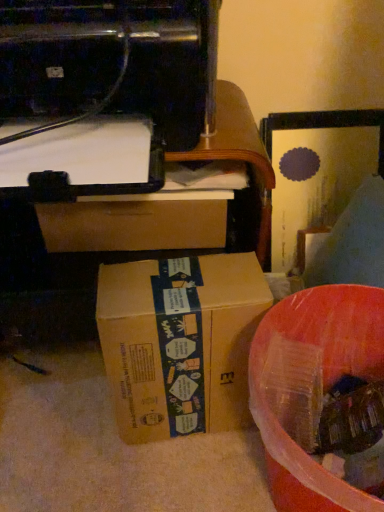
Question: Could you tell me if brown cardboard box at center is facing translucent plastic container at lower right?

Choices:
 (A) no
 (B) yes

Answer: (A)

Question: Is brown cardboard box at center facing away from translucent plastic container at lower right?

Choices:
 (A) yes
 (B) no

Answer: (B)

Question: Is brown cardboard box at center wider than translucent plastic container at lower right?

Choices:
 (A) no
 (B) yes

Answer: (A)

Question: Considering the relative positions of brown cardboard box at center and translucent plastic container at lower right in the image provided, is brown cardboard box at center to the left of translucent plastic container at lower right from the viewer's perspective?

Choices:
 (A) yes
 (B) no

Answer: (A)

Question: Would you say brown cardboard box at center is outside translucent plastic container at lower right?

Choices:
 (A) no
 (B) yes

Answer: (B)

Question: Can you confirm if brown cardboard box at center is shorter than translucent plastic container at lower right?

Choices:
 (A) yes
 (B) no

Answer: (A)

Question: From the image's perspective, is translucent plastic container at lower right located above brown cardboard box at center?

Choices:
 (A) no
 (B) yes

Answer: (A)

Question: Does translucent plastic container at lower right lie behind brown cardboard box at center?

Choices:
 (A) no
 (B) yes

Answer: (A)

Question: From a real-world perspective, is translucent plastic container at lower right on top of brown cardboard box at center?

Choices:
 (A) yes
 (B) no

Answer: (B)

Question: Could brown cardboard box at center be considered to be inside translucent plastic container at lower right?

Choices:
 (A) yes
 (B) no

Answer: (B)

Question: Can you confirm if translucent plastic container at lower right is smaller than brown cardboard box at center?

Choices:
 (A) no
 (B) yes

Answer: (A)

Question: Would you consider translucent plastic container at lower right to be distant from brown cardboard box at center?

Choices:
 (A) yes
 (B) no

Answer: (B)

Question: Does black plastic printer at upper left come in front of translucent plastic container at lower right?

Choices:
 (A) no
 (B) yes

Answer: (B)